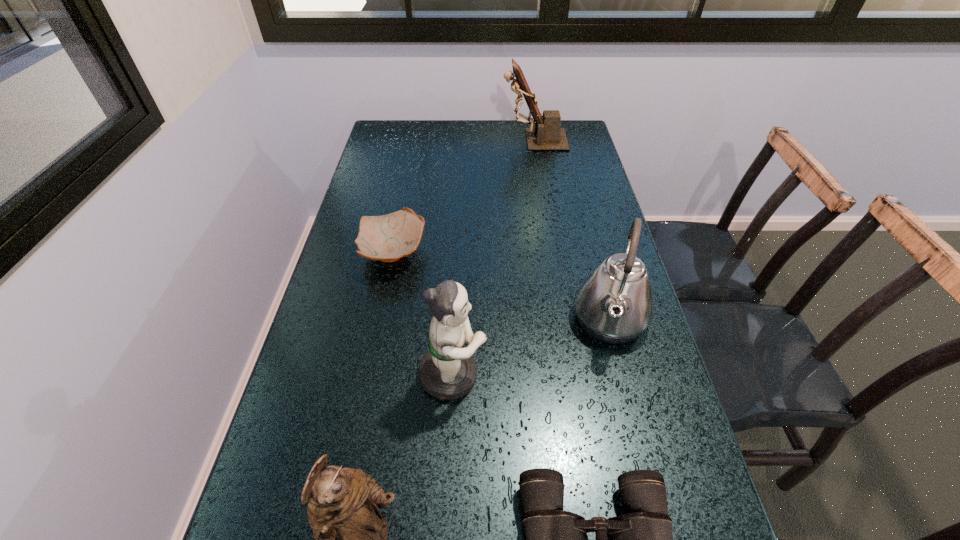
You are a GUI agent. You are given a task and a screenshot of the screen. Output one action in this format:
    pyautogui.click(x=<x>, y=<y>)
    Task: Click on the free location that satisfies the following two spatial constraints: 1. on the back side of the kettle; 2. on the front-facing side of the rightmost figurine
    This screenshot has height=540, width=960.
    Given the screenshot: What is the action you would take?
    pyautogui.click(x=563, y=140)

What are the coordinates of `free point that satisfies the following two spatial constraints: 1. on the front-facing side of the kettle; 2. on the left side of the farthest figurine` in the screenshot? It's located at (564, 320).